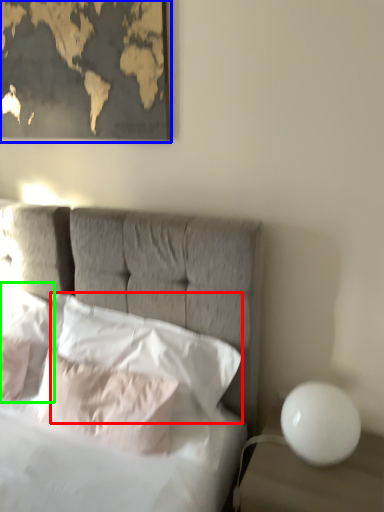
Question: Based on their relative distances, which object is farther from pillow (highlighted by a red box)? Choose from picture frame (highlighted by a blue box) and pillow (highlighted by a green box).

Choices:
 (A) picture frame
 (B) pillow

Answer: (A)